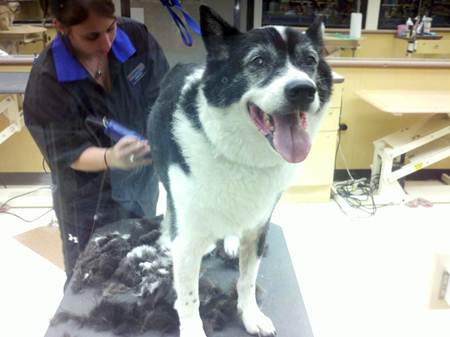
I want to click on countertop, so click(x=397, y=58), click(x=24, y=58), click(x=276, y=293).